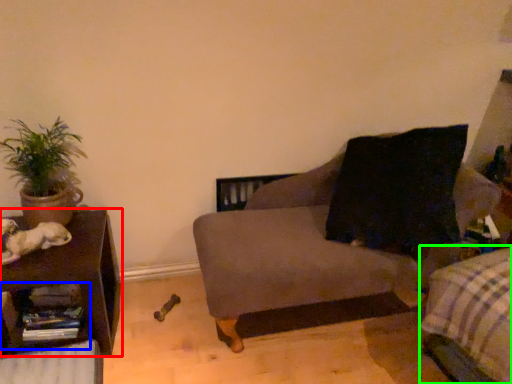
Question: Estimate the real-world distances between objects in this image. Which object is farther from table (highlighted by a red box), shelf (highlighted by a blue box) or bedding (highlighted by a green box)?

Choices:
 (A) shelf
 (B) bedding

Answer: (B)